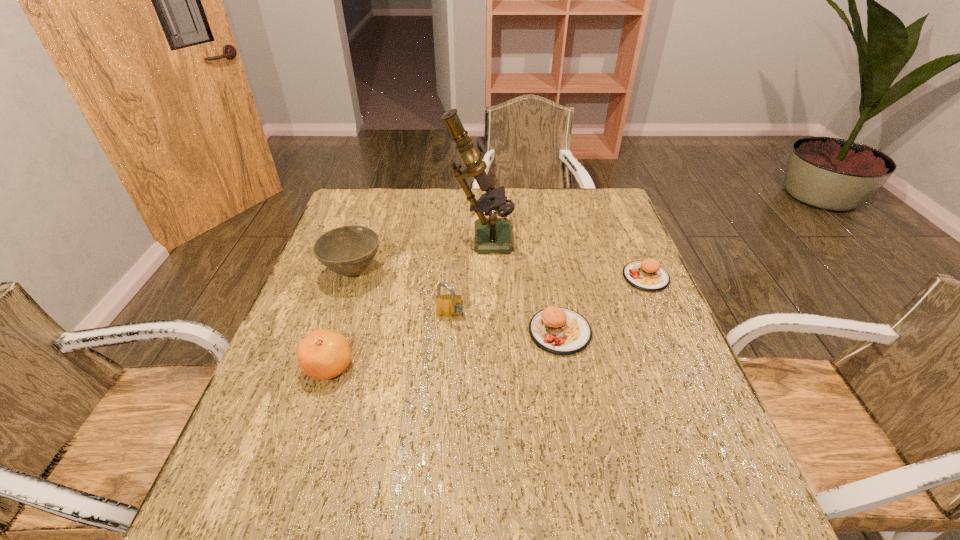
This screenshot has width=960, height=540. Find the location of `vacant region located 0.140m on the front of the bowl`. vacant region located 0.140m on the front of the bowl is located at coordinates (333, 332).

Where is `vacant space located 0.090m on the front of the third shortest object`? vacant space located 0.090m on the front of the third shortest object is located at coordinates (310, 424).

Identify the location of free spot located 0.060m at the eyepiece of the tallest object. This screenshot has width=960, height=540. (532, 235).

The height and width of the screenshot is (540, 960). Identify the location of vacant space located 0.300m on the side with the combination dials of the padlock. (442, 437).

The height and width of the screenshot is (540, 960). Identify the location of object at the far edge. 492,235.

This screenshot has height=540, width=960. In order to click on bowl that is positioned at the left edge in this screenshot , I will do `click(348, 250)`.

Where is `clementine that is positioned at the left edge`? clementine that is positioned at the left edge is located at coordinates (323, 354).

Find the location of a particular element. Image resolution: width=960 pixels, height=540 pixels. object situated at the right edge is located at coordinates (647, 275).

Locate an element on the screen. The width and height of the screenshot is (960, 540). vacant space at the far edge of the desktop is located at coordinates (422, 193).

In the image, there is a desktop. Identify the location of vacant space at the near edge. The height and width of the screenshot is (540, 960). tap(394, 461).